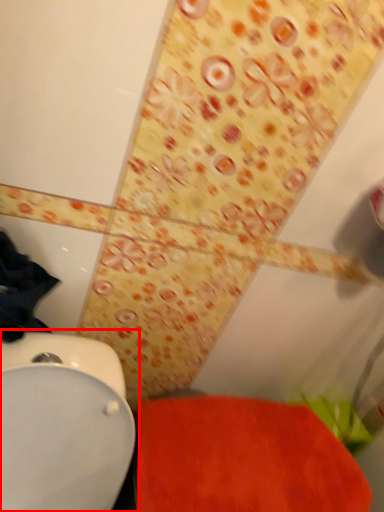
Question: From the image's perspective, what is the correct spatial relationship of toilet (annotated by the red box) in relation to bath mat?

Choices:
 (A) above
 (B) below

Answer: (B)